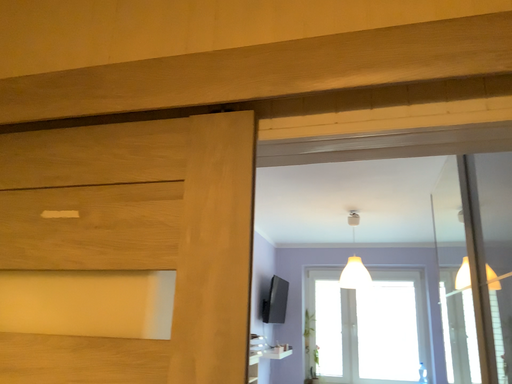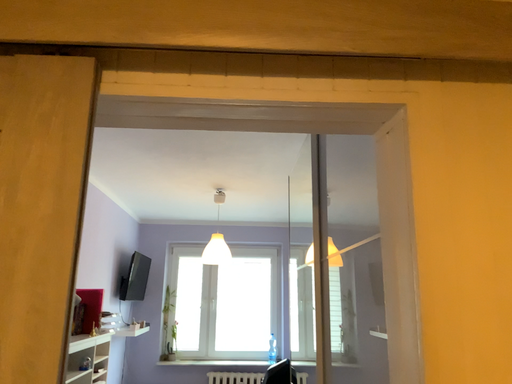
Question: How did the camera likely rotate when shooting the video?

Choices:
 (A) rotated right
 (B) rotated left

Answer: (A)